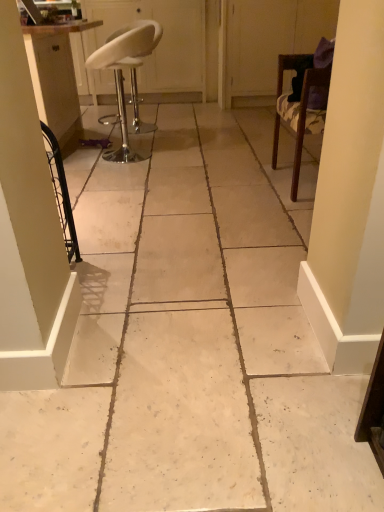
What do you see at coordinates (298, 109) in the screenshot? I see `wooden chair at right, which is counted as the 2th chair, starting from the left` at bounding box center [298, 109].

Locate an element on the screen. Image resolution: width=384 pixels, height=512 pixels. wooden chair at right, arranged as the 1th chair when viewed from the right is located at coordinates (298, 109).

What do you see at coordinates (159, 45) in the screenshot? The width and height of the screenshot is (384, 512). I see `white leather stool at upper left, the 1th screen door viewed from the left` at bounding box center [159, 45].

This screenshot has width=384, height=512. I want to click on matte white cabinet at left, so click(56, 75).

I want to click on wooden chair at right, arranged as the 1th chair when viewed from the right, so click(298, 109).

Consider the image. Considering the relative sizes of wooden chair at right, which is counted as the 2th chair, starting from the left, and transparent plastic screen door at upper right, which is the second screen door in left-to-right order, in the image provided, is wooden chair at right, which is counted as the 2th chair, starting from the left, wider than transparent plastic screen door at upper right, which is the second screen door in left-to-right order,?

Incorrect, the width of wooden chair at right, which is counted as the 2th chair, starting from the left, does not surpass that of transparent plastic screen door at upper right, which is the second screen door in left-to-right order.

Is wooden chair at right, which is counted as the 2th chair, starting from the left, positioned far away from transparent plastic screen door at upper right, the 1th screen door positioned from the right?

Yes, wooden chair at right, which is counted as the 2th chair, starting from the left, and transparent plastic screen door at upper right, the 1th screen door positioned from the right, are located far from each other.

Is wooden chair at right, arranged as the 1th chair when viewed from the right, further to the viewer compared to transparent plastic screen door at upper right, the 1th screen door positioned from the right?

No, wooden chair at right, arranged as the 1th chair when viewed from the right, is in front of transparent plastic screen door at upper right, the 1th screen door positioned from the right.

From the image's perspective, which one is positioned higher, wooden chair at right, arranged as the 1th chair when viewed from the right, or transparent plastic screen door at upper right, the 1th screen door positioned from the right?

transparent plastic screen door at upper right, the 1th screen door positioned from the right.

Which point is more distant from viewer, (x=128, y=50) or (x=49, y=50)?

The point (x=49, y=50) is farther from the camera.

Is white leather stool at upper left, acting as the 2th chair starting from the right, looking in the opposite direction of matte white cabinet at left?

No, white leather stool at upper left, acting as the 2th chair starting from the right,'s orientation is not away from matte white cabinet at left.

Which of these two, white leather stool at upper left, placed as the 1th chair when sorted from left to right, or matte white cabinet at left, is bigger?

Bigger between the two is matte white cabinet at left.

Choose the correct answer: Is white leather stool at upper left, acting as the 2th chair starting from the right, inside matte white cabinet at left or outside it?

white leather stool at upper left, acting as the 2th chair starting from the right, is not inside matte white cabinet at left, it's outside.

Considering the points (146, 77) and (76, 91), which point is behind, point (146, 77) or point (76, 91)?

The point (146, 77) is farther.

From a real-world perspective, which is physically above, white leather stool at upper left, the 1th screen door viewed from the left, or matte white cabinet at left?

white leather stool at upper left, the 1th screen door viewed from the left.

How much distance is there between white leather stool at upper left, the 1th screen door viewed from the left, and matte white cabinet at left?

white leather stool at upper left, the 1th screen door viewed from the left, and matte white cabinet at left are 1.45 meters apart from each other.

Is white leather stool at upper left, the 2th screen door in the right-to-left sequence, positioned far away from matte white cabinet at left?

white leather stool at upper left, the 2th screen door in the right-to-left sequence, is far away from matte white cabinet at left.

Would you consider matte white cabinet at left to be distant from white leather stool at upper left, the 1th screen door viewed from the left?

Absolutely, matte white cabinet at left is distant from white leather stool at upper left, the 1th screen door viewed from the left.

Which screen door is the 1st one when counting from the right side of the matte white cabinet at left? Please provide its 2D coordinates.

[(159, 45)]

Is point (61, 42) positioned behind point (106, 7)?

No, it is not.

Is point (324, 75) less distant than point (148, 44)?

That is True.

Is wooden chair at right, which is counted as the 2th chair, starting from the left, positioned in front of white leather stool at upper left, acting as the 2th chair starting from the right?

Yes, wooden chair at right, which is counted as the 2th chair, starting from the left, is closer to the viewer.

Could you tell me if wooden chair at right, arranged as the 1th chair when viewed from the right, is facing white leather stool at upper left, placed as the 1th chair when sorted from left to right?

No, wooden chair at right, arranged as the 1th chair when viewed from the right, does not turn towards white leather stool at upper left, placed as the 1th chair when sorted from left to right.

From the image's perspective, which one is positioned higher, wooden chair at right, arranged as the 1th chair when viewed from the right, or white leather stool at upper left, acting as the 2th chair starting from the right?

From the image's view, white leather stool at upper left, acting as the 2th chair starting from the right, is above.

Does point (102, 53) appear closer or farther from the camera than point (155, 102)?

Point (102, 53) is positioned closer to the camera compared to point (155, 102).

Is white leather stool at upper left, placed as the 1th chair when sorted from left to right, oriented away from white leather stool at upper left, the 2th screen door in the right-to-left sequence?

No.

Do you think white leather stool at upper left, acting as the 2th chair starting from the right, is within white leather stool at upper left, the 1th screen door viewed from the left, or outside of it?

white leather stool at upper left, acting as the 2th chair starting from the right, is not inside white leather stool at upper left, the 1th screen door viewed from the left, it's outside.

Is white leather stool at upper left, placed as the 1th chair when sorted from left to right, taller than white leather stool at upper left, the 1th screen door viewed from the left?

Incorrect, the height of white leather stool at upper left, placed as the 1th chair when sorted from left to right, is not larger of that of white leather stool at upper left, the 1th screen door viewed from the left.

This screenshot has height=512, width=384. In order to click on screen door on the right of white leather stool at upper left, the 1th screen door viewed from the left in this screenshot , I will do `click(256, 48)`.

Would you consider transparent plastic screen door at upper right, which is the second screen door in left-to-right order, to be distant from white leather stool at upper left, the 2th screen door in the right-to-left sequence?

No, transparent plastic screen door at upper right, which is the second screen door in left-to-right order, is not far from white leather stool at upper left, the 2th screen door in the right-to-left sequence.

Which is more to the left, transparent plastic screen door at upper right, the 1th screen door positioned from the right, or white leather stool at upper left, the 1th screen door viewed from the left?

white leather stool at upper left, the 1th screen door viewed from the left.

Based on the photo, considering the positions of objects transparent plastic screen door at upper right, the 1th screen door positioned from the right, and white leather stool at upper left, the 2th screen door in the right-to-left sequence, in the image provided, who is in front, transparent plastic screen door at upper right, the 1th screen door positioned from the right, or white leather stool at upper left, the 2th screen door in the right-to-left sequence,?

transparent plastic screen door at upper right, the 1th screen door positioned from the right, is more forward.

Find the location of a particular element. Image resolution: width=384 pixels, height=512 pixels. the 1st chair to the left when counting from the transparent plastic screen door at upper right, which is the second screen door in left-to-right order is located at coordinates (298, 109).

Find the location of a particular element. The width and height of the screenshot is (384, 512). cabinetry above the white leather stool at upper left, acting as the 2th chair starting from the right (from the image's perspective) is located at coordinates (56, 75).

Considering their positions, is matte white cabinet at left positioned closer to transparent plastic screen door at upper right, which is the second screen door in left-to-right order, than white leather stool at upper left, placed as the 1th chair when sorted from left to right?

matte white cabinet at left is positioned closer to the anchor transparent plastic screen door at upper right, which is the second screen door in left-to-right order.

Looking at the image, which one is located closer to matte white cabinet at left, white leather stool at upper left, placed as the 1th chair when sorted from left to right, or white leather stool at upper left, the 1th screen door viewed from the left?

white leather stool at upper left, placed as the 1th chair when sorted from left to right.

Looking at the image, which one is located further to white leather stool at upper left, acting as the 2th chair starting from the right, wooden chair at right, which is counted as the 2th chair, starting from the left, or matte white cabinet at left?

wooden chair at right, which is counted as the 2th chair, starting from the left.

From the image, which object appears to be farther from white leather stool at upper left, the 2th screen door in the right-to-left sequence, matte white cabinet at left or wooden chair at right, arranged as the 1th chair when viewed from the right?

wooden chair at right, arranged as the 1th chair when viewed from the right, lies further to white leather stool at upper left, the 2th screen door in the right-to-left sequence, than the other object.

Based on their spatial positions, is transparent plastic screen door at upper right, the 1th screen door positioned from the right, or matte white cabinet at left closer to wooden chair at right, arranged as the 1th chair when viewed from the right?

Among the two, matte white cabinet at left is located nearer to wooden chair at right, arranged as the 1th chair when viewed from the right.

Based on their spatial positions, is wooden chair at right, which is counted as the 2th chair, starting from the left, or white leather stool at upper left, placed as the 1th chair when sorted from left to right, closer to matte white cabinet at left?

white leather stool at upper left, placed as the 1th chair when sorted from left to right, lies closer to matte white cabinet at left than the other object.

From the image, which object appears to be nearer to matte white cabinet at left, white leather stool at upper left, placed as the 1th chair when sorted from left to right, or transparent plastic screen door at upper right, the 1th screen door positioned from the right?

Among the two, white leather stool at upper left, placed as the 1th chair when sorted from left to right, is located nearer to matte white cabinet at left.

Which object lies further to the anchor point white leather stool at upper left, the 2th screen door in the right-to-left sequence, white leather stool at upper left, placed as the 1th chair when sorted from left to right, or transparent plastic screen door at upper right, the 1th screen door positioned from the right?

white leather stool at upper left, placed as the 1th chair when sorted from left to right.

Where is `chair positioned between wooden chair at right, which is counted as the 2th chair, starting from the left, and white leather stool at upper left, the 2th screen door in the right-to-left sequence, from near to far`? The width and height of the screenshot is (384, 512). chair positioned between wooden chair at right, which is counted as the 2th chair, starting from the left, and white leather stool at upper left, the 2th screen door in the right-to-left sequence, from near to far is located at coordinates (122, 75).

Identify the location of screen door between matte white cabinet at left and transparent plastic screen door at upper right, the 1th screen door positioned from the right, from left to right. (159, 45).

Identify the location of chair between wooden chair at right, arranged as the 1th chair when viewed from the right, and transparent plastic screen door at upper right, the 1th screen door positioned from the right, in the front-back direction. (122, 75).

Locate an element on the screen. chair located between matte white cabinet at left and wooden chair at right, arranged as the 1th chair when viewed from the right, in the left-right direction is located at coordinates (122, 75).